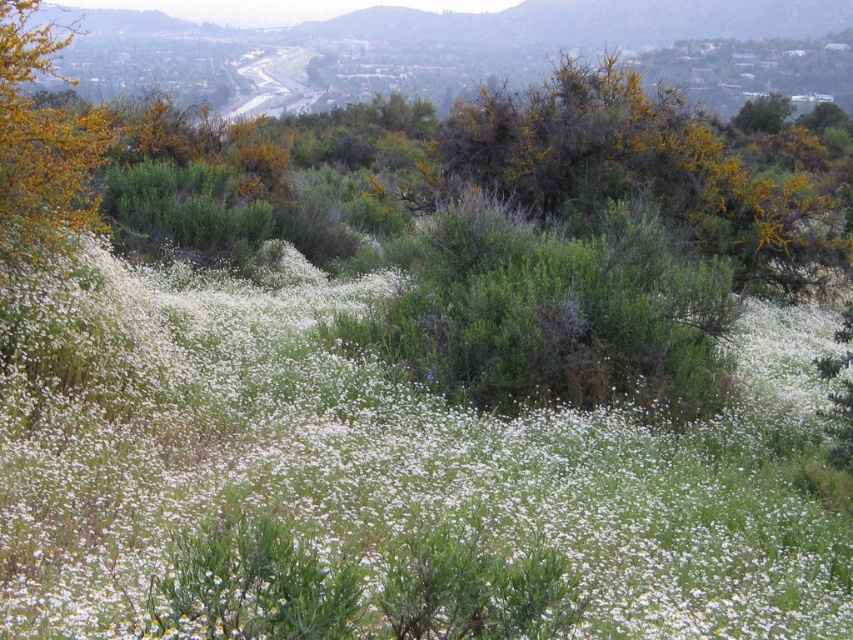
You are standing in the center of a field of white wildflowers and notice a specific point marked at coordinates (366,467). What is located at this point?

Result: The point at (366,467) corresponds to white soft petals at center.

You are a photographer standing in the field of white wildflowers. You want to take a photo that includes both the white soft petals at center and the green leafy bush at upper right. Which object should you focus on first to ensure both are in sharp focus?

To ensure both the white soft petals at center and the green leafy bush at upper right are in sharp focus, you should focus on the white soft petals at center first since it is closer to you than the green leafy bush at upper right.